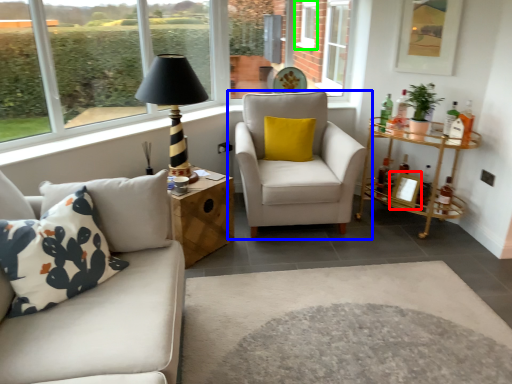
Question: Based on their relative distances, which object is nearer to picture frame (highlighted by a red box)? Choose from chair (highlighted by a blue box) and window (highlighted by a green box).

Choices:
 (A) chair
 (B) window

Answer: (A)